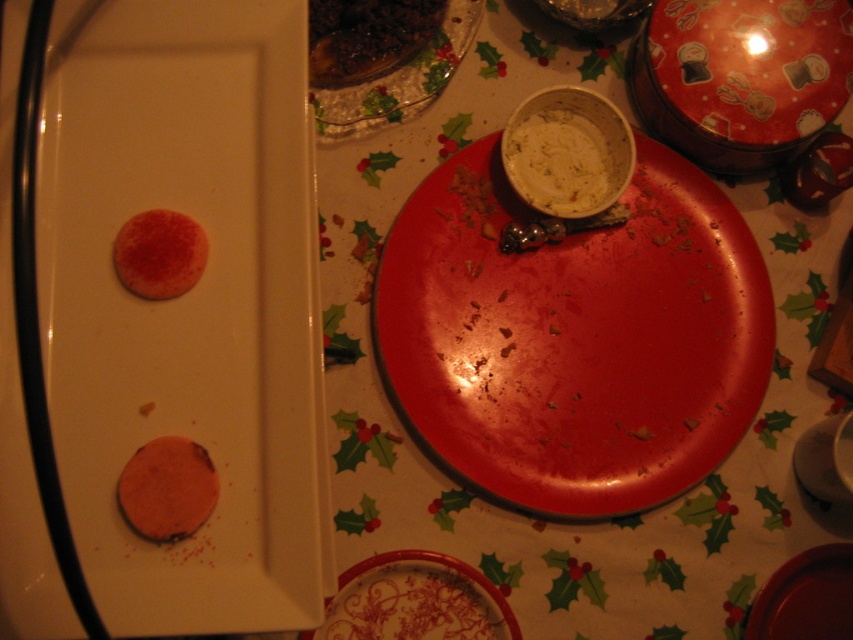
Between porcelain plate with floral design at lower center and shiny brown meat at upper center, which one is positioned lower?

porcelain plate with floral design at lower center is below.

Which is in front, point (492, 634) or point (444, 8)?

Positioned in front is point (492, 634).

Identify the location of porcelain plate with floral design at lower center. (415, 602).

The width and height of the screenshot is (853, 640). Find the location of `porcelain plate with floral design at lower center`. porcelain plate with floral design at lower center is located at coordinates (415, 602).

Can you confirm if shiny brown meat at upper center is taller than orange matte cookie at lower left?

Indeed, shiny brown meat at upper center has a greater height compared to orange matte cookie at lower left.

Is point (358, 35) positioned after point (158, 472)?

That is True.

Locate an element on the screen. Image resolution: width=853 pixels, height=640 pixels. shiny brown meat at upper center is located at coordinates (366, 36).

Who is higher up, clear glass plate at upper center or matte red cookie at upper left?

clear glass plate at upper center is above.

Describe the element at coordinates (398, 81) in the screenshot. I see `clear glass plate at upper center` at that location.

This screenshot has width=853, height=640. What do you see at coordinates (398, 81) in the screenshot? I see `clear glass plate at upper center` at bounding box center [398, 81].

At what (x,y) coordinates should I click in order to perform the action: click on clear glass plate at upper center. Please return your answer as a coordinate pair (x, y). This screenshot has width=853, height=640. Looking at the image, I should click on (398, 81).